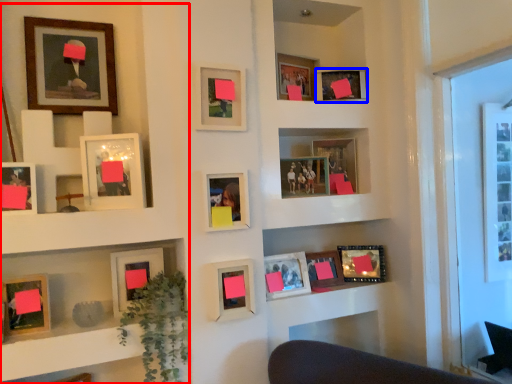
Question: Which point is closer to the camera, bookcase (highlighted by a red box) or picture frame (highlighted by a blue box)?

Choices:
 (A) bookcase
 (B) picture frame

Answer: (A)